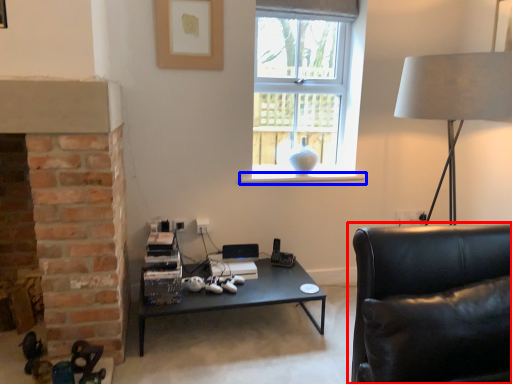
Question: Among these objects, which one is farthest to the camera, studio couch (highlighted by a red box) or window sill (highlighted by a blue box)?

Choices:
 (A) studio couch
 (B) window sill

Answer: (B)